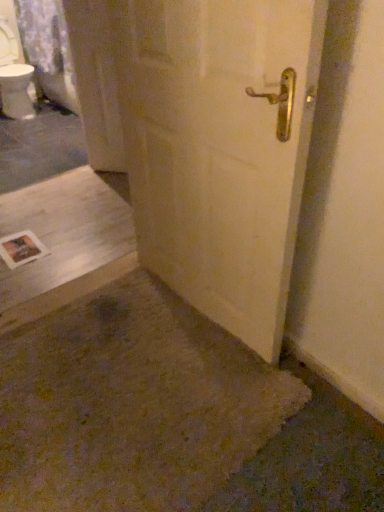
Locate an element on the screen. The height and width of the screenshot is (512, 384). empty space that is ontop of white concrete at lower left is located at coordinates (69, 241).